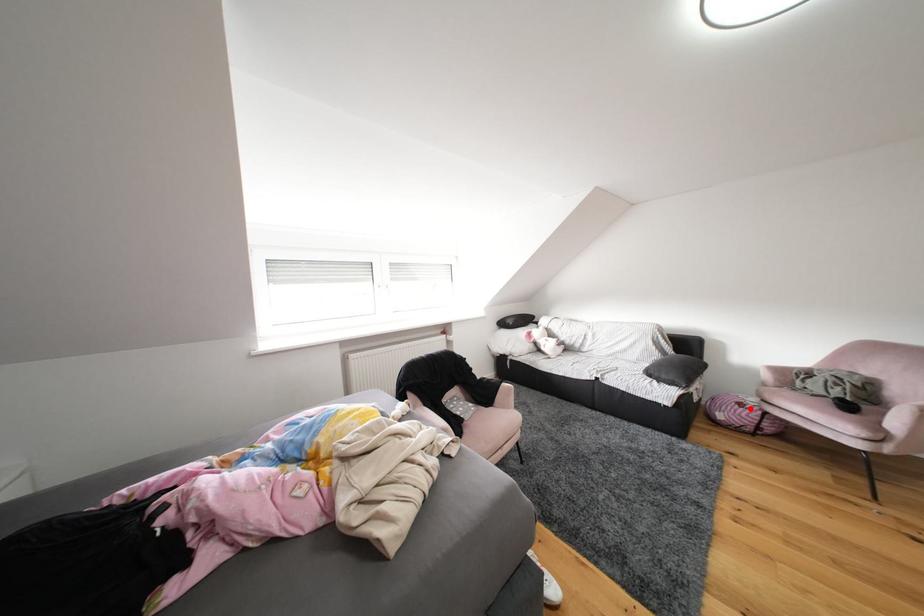
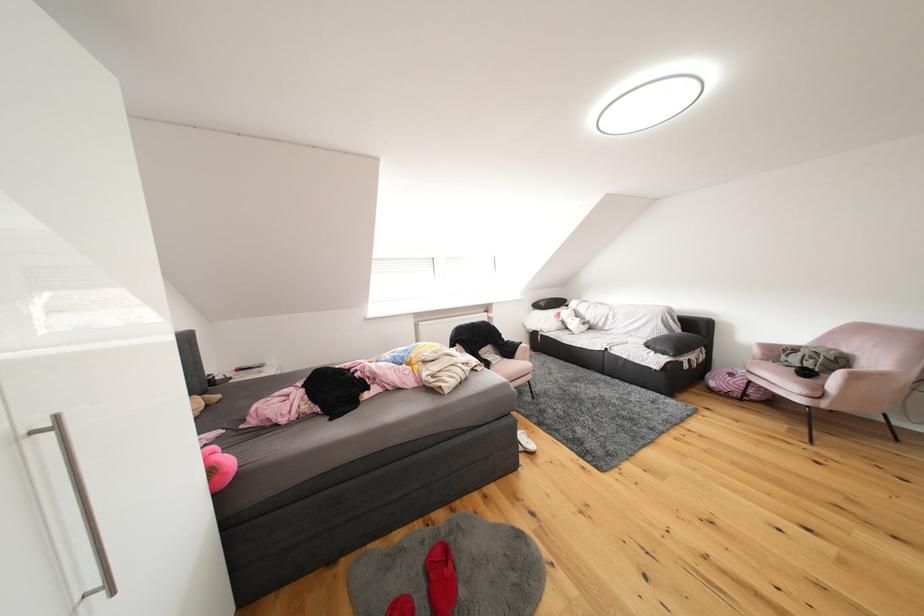
Where in the second image is the point corresponding to the highlighted location from the first image?

(740, 379)